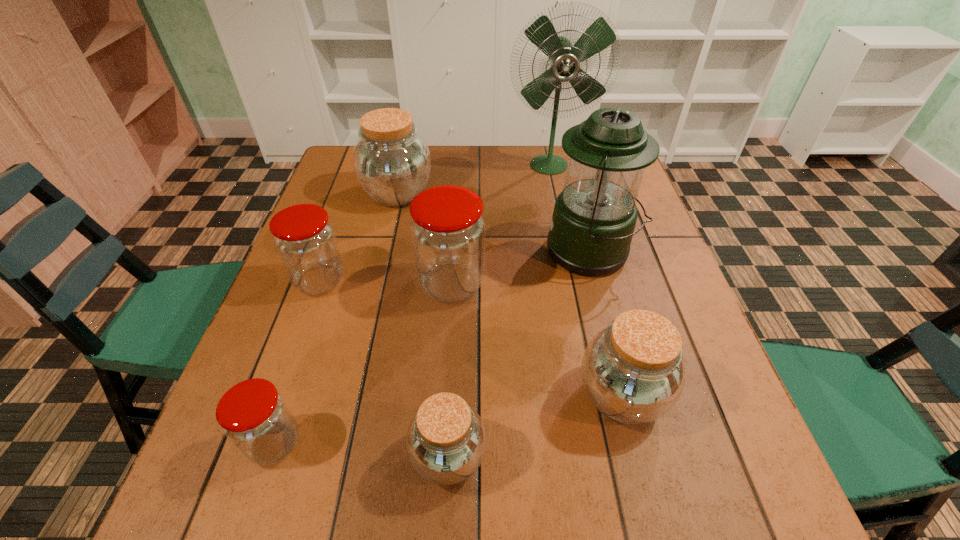
Locate an element on the screen. green fan is located at coordinates (564, 58).

What are the coordinates of `fan` in the screenshot? It's located at (564, 58).

I want to click on the seventh shortest object, so click(594, 217).

At what (x,y) coordinates should I click in order to perform the action: click on green lantern. Please return your answer as a coordinate pair (x, y). Image resolution: width=960 pixels, height=540 pixels. Looking at the image, I should click on (594, 217).

You are a GUI agent. You are given a task and a screenshot of the screen. Output one action in this format:
    pyautogui.click(x=<x>, y=<y>)
    Task: Click on the leftmost brown jar
    The height and width of the screenshot is (540, 960).
    Given the screenshot: What is the action you would take?
    pyautogui.click(x=392, y=162)

Locate an element on the screen. This screenshot has height=540, width=960. the farthest jar is located at coordinates (392, 162).

What are the coordinates of `the biggest red jar` in the screenshot? It's located at (448, 231).

Where is `the second smallest red jar`? The image size is (960, 540). the second smallest red jar is located at coordinates (305, 240).

At what (x,y) coordinates should I click in order to perform the action: click on the second biggest brown jar. Please return your answer as a coordinate pair (x, y). The height and width of the screenshot is (540, 960). Looking at the image, I should click on (632, 371).

Find the location of `the rightmost jar`. the rightmost jar is located at coordinates [x=632, y=371].